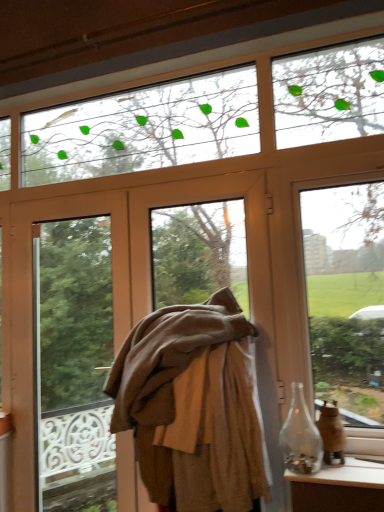
You are a GUI agent. You are given a task and a screenshot of the screen. Output one action in this format:
    pyautogui.click(x=<x>, y=<y>)
    Task: Click on the empty space that is ontop of transparent glass jar at lower right
    This screenshot has width=384, height=512.
    Given the screenshot: What is the action you would take?
    pyautogui.click(x=349, y=466)